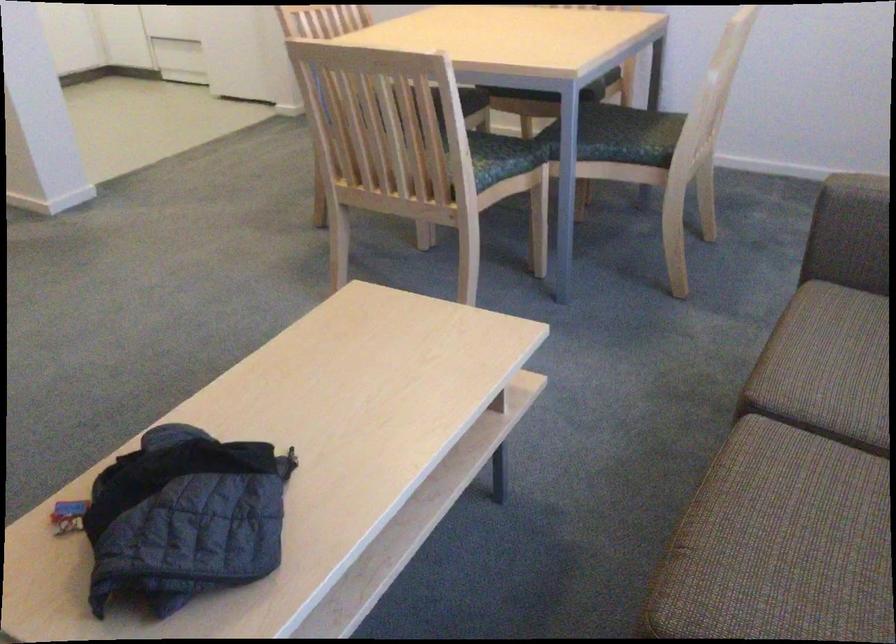
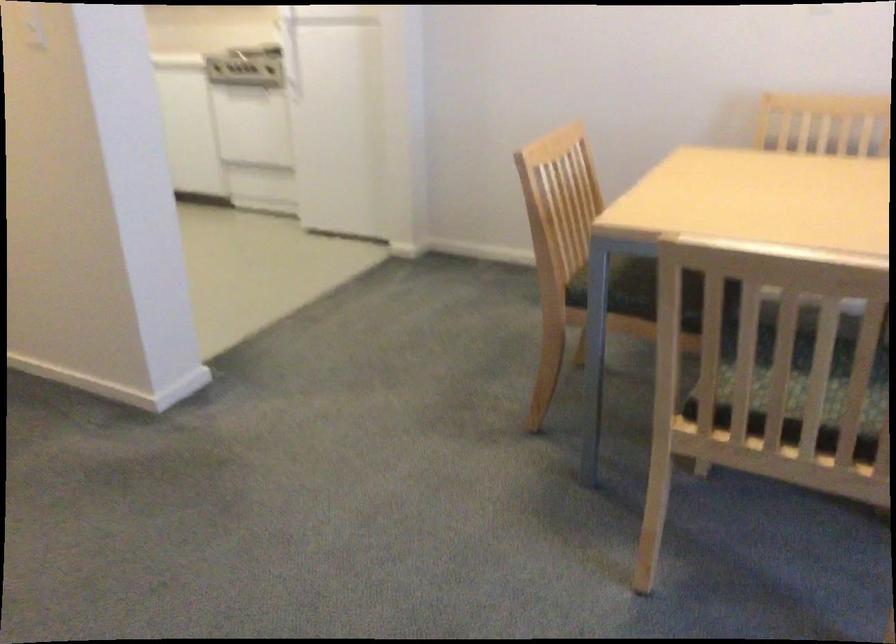
What movement of the cameraman would produce the second image?

The movement direction of the cameraman is left, forward.